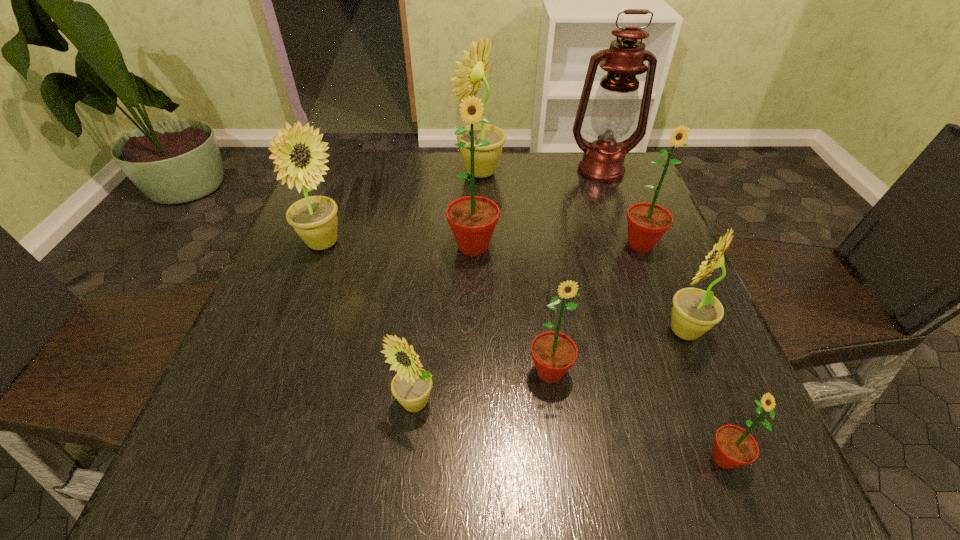
I want to click on oil lamp, so point(615,104).

This screenshot has height=540, width=960. I want to click on the farthest sunflower, so click(471, 76).

This screenshot has width=960, height=540. I want to click on the biggest yellow sunflower, so click(471, 76).

Where is `the biggest green sunflower`? Image resolution: width=960 pixels, height=540 pixels. the biggest green sunflower is located at coordinates (472, 219).

The height and width of the screenshot is (540, 960). In order to click on the second farthest yellow sunflower in this screenshot , I will do `click(314, 219)`.

At what (x,y) coordinates should I click in order to perform the action: click on the leftmost yellow sunflower. Please return your answer as a coordinate pair (x, y). Looking at the image, I should click on (314, 219).

I want to click on the second biggest green sunflower, so click(x=647, y=222).

The width and height of the screenshot is (960, 540). I want to click on the rightmost yellow sunflower, so click(695, 311).

Locate an element on the screen. This screenshot has height=540, width=960. the sixth farthest object is located at coordinates (695, 311).

The image size is (960, 540). Identify the location of the third farthest green sunflower. (553, 353).